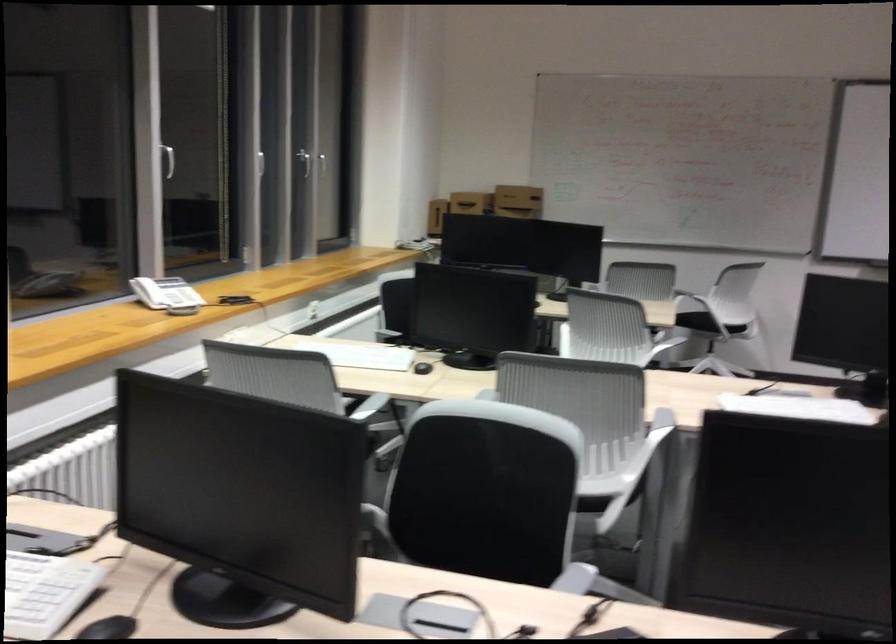
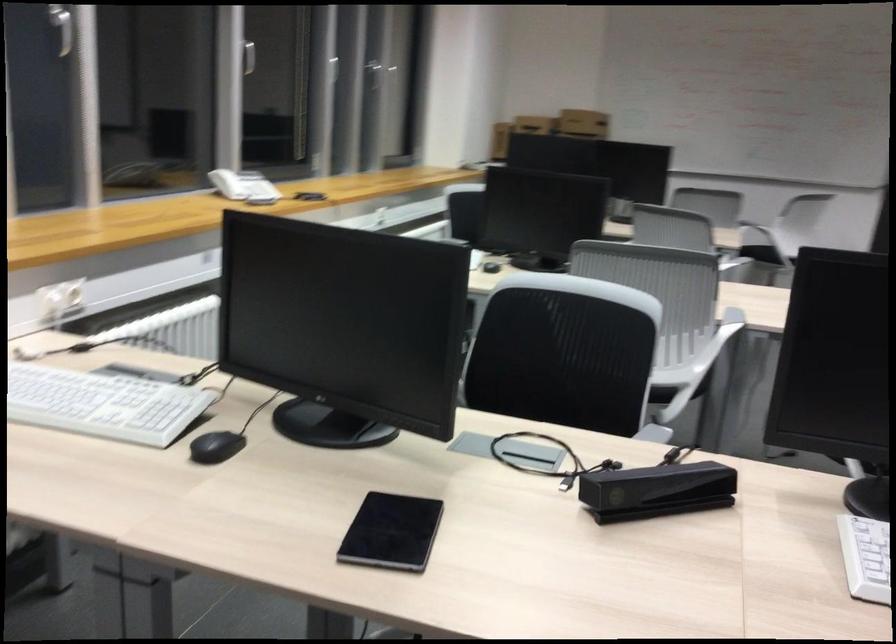
In the second image, find the point that corresponds to pixel 151 289 in the first image.

(227, 184)